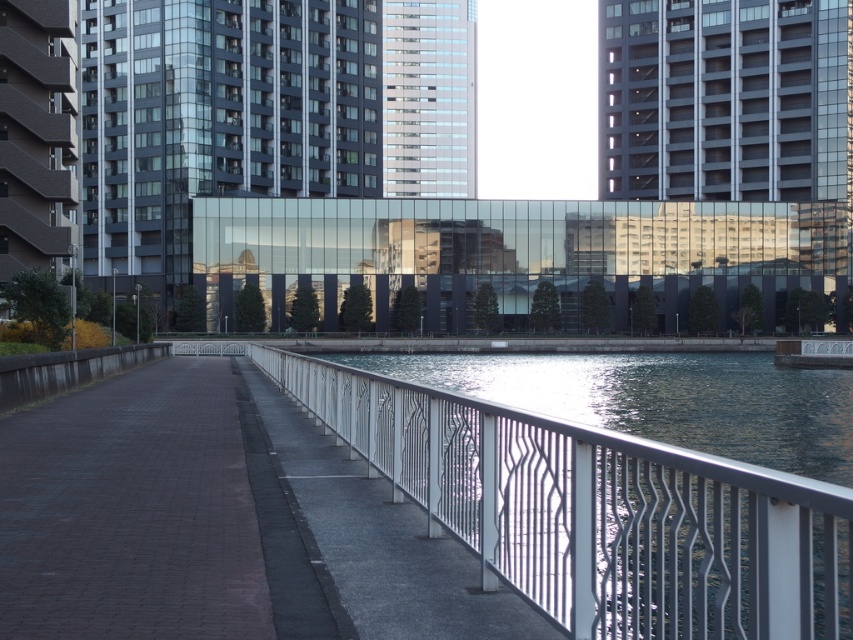
Consider the image. Between metallic water at center and transparent glass bridge at center, which one has more height?

transparent glass bridge at center

Measure the distance between point [611,632] and camera.

A distance of 4.40 meters exists between point [611,632] and camera.

Is point (801, 614) farther from camera compared to point (793, 234)?

That is False.

You are a GUI agent. You are given a task and a screenshot of the screen. Output one action in this format:
    pyautogui.click(x=<x>, y=<y>)
    Task: Click on the metallic water at center
    The image size is (853, 640).
    Given the screenshot: What is the action you would take?
    pyautogui.click(x=598, y=512)